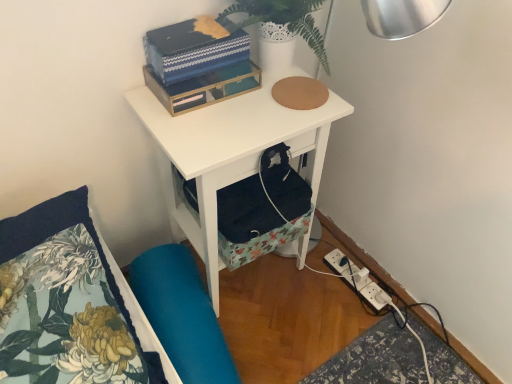
Question: Which is correct: blue textured box at upper center is inside floral fabric pillow at lower left, or outside of it?

Choices:
 (A) inside
 (B) outside

Answer: (B)

Question: In the image, is blue textured box at upper center positioned in front of or behind floral fabric pillow at lower left?

Choices:
 (A) behind
 (B) front

Answer: (A)

Question: Which is nearer to the white matte nightstand at upper center?

Choices:
 (A) floral fabric pillow at lower left
 (B) blue textured box at upper center
 (C) white plastic power strip at lower right
 (D) white textured vase at upper center
 (E) teal fabric swivel chair at lower left

Answer: (B)

Question: Considering the real-world distances, which object is farthest from the white plastic power strip at lower right?

Choices:
 (A) white textured vase at upper center
 (B) blue textured box at upper center
 (C) white matte nightstand at upper center
 (D) floral fabric pillow at lower left
 (E) teal fabric swivel chair at lower left

Answer: (D)